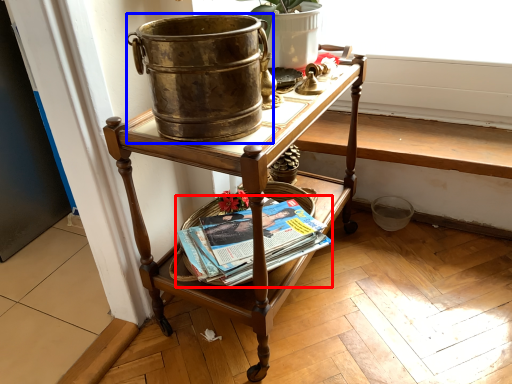
Question: Which of the following is the farthest to the observer, paperback book (highlighted by a red box) or flowerpot (highlighted by a blue box)?

Choices:
 (A) paperback book
 (B) flowerpot

Answer: (A)